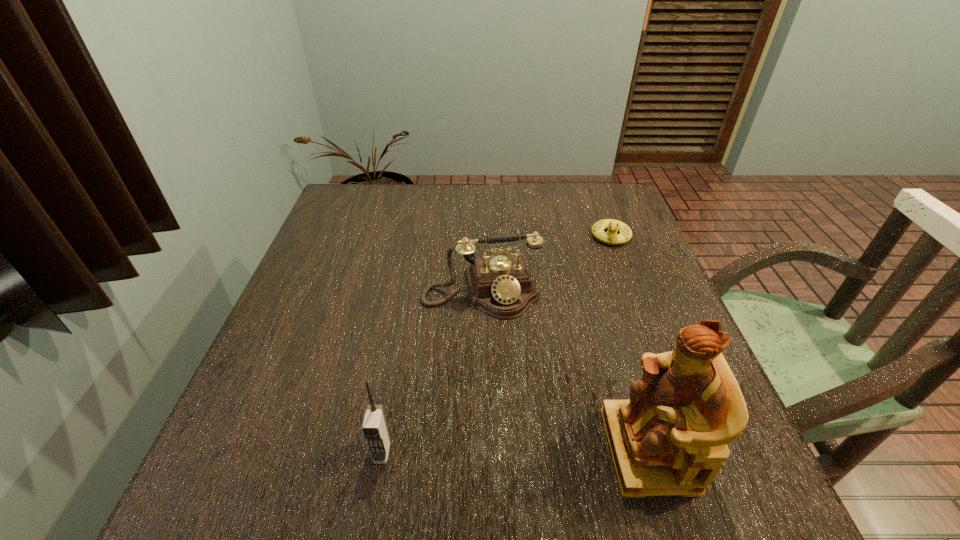
Identify the location of the closest object relative to the third nearest object. The height and width of the screenshot is (540, 960). (611, 237).

Identify the location of vacant space that satisfies the following two spatial constraints: 1. on the front side of the tallest object; 2. on the front-facing side of the telephone. (482, 450).

Image resolution: width=960 pixels, height=540 pixels. What are the coordinates of `vacant space that satisfies the following two spatial constraints: 1. on the back side of the duckling; 2. on the right side of the telephone` in the screenshot? It's located at (481, 236).